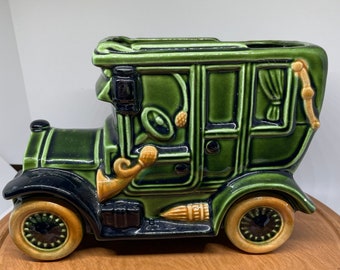
Identify the location of curtain. (272, 87).